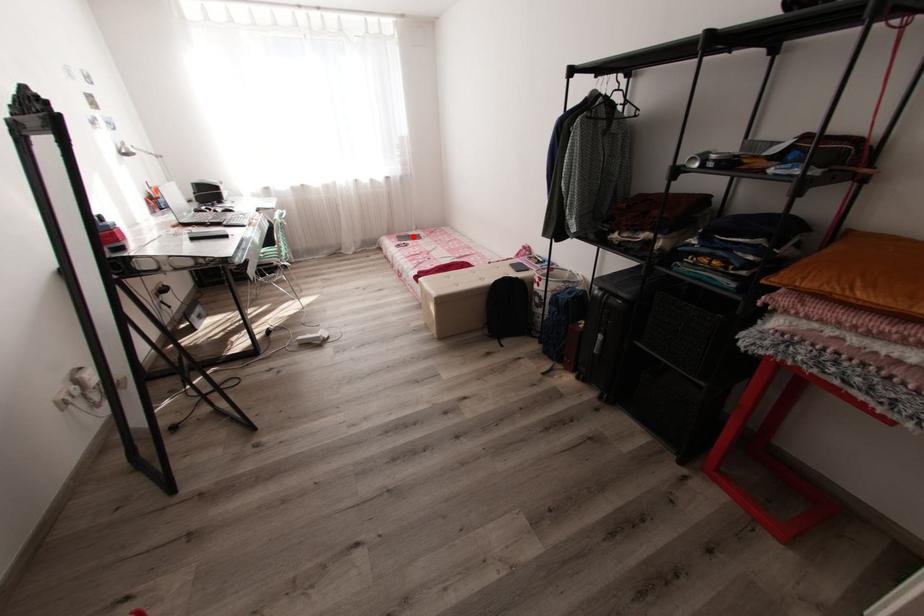
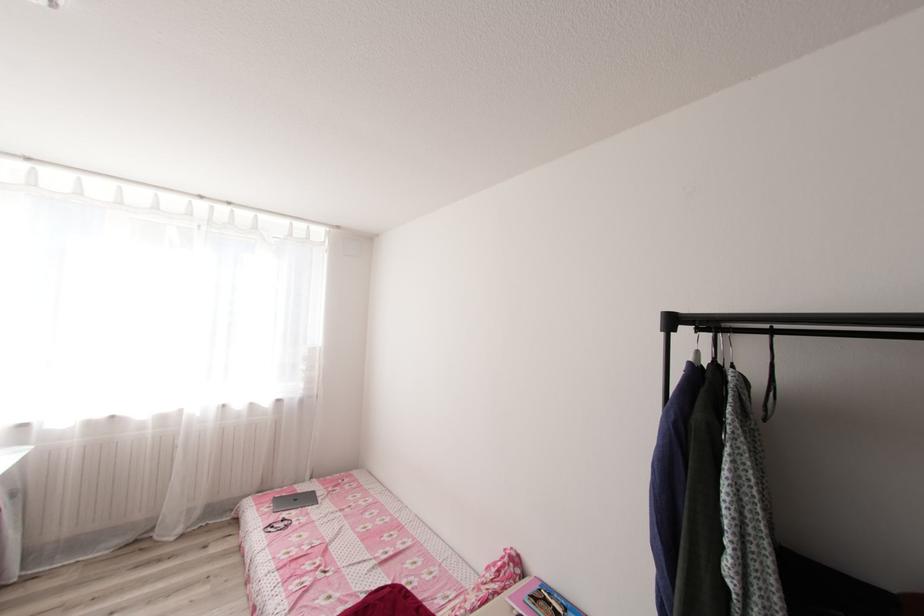
Locate, in the second image, the point that corresponds to the highlighted location in the first image.

(300, 499)